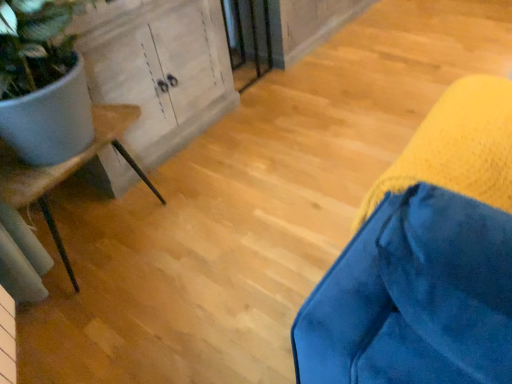
Locate an element on the screen. vacant area located to the right-hand side of wooden cabinet at left is located at coordinates (278, 129).